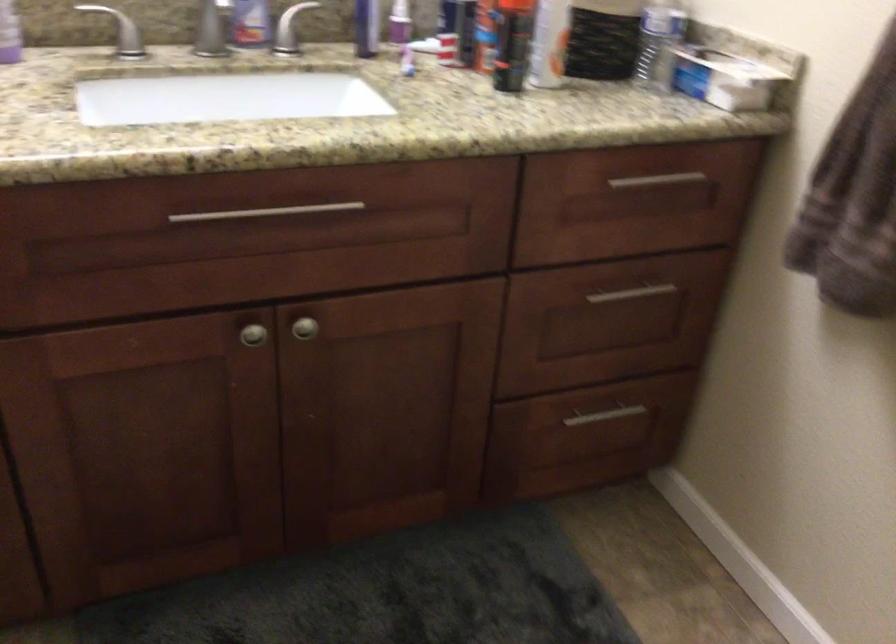
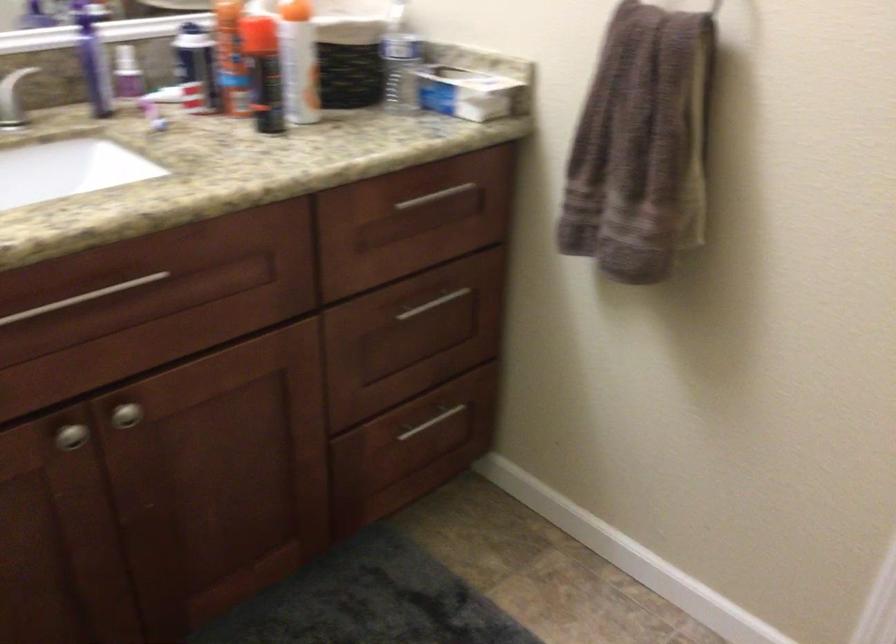
Find the pixel in the second image that matches pixel 633 295 in the first image.

(434, 304)